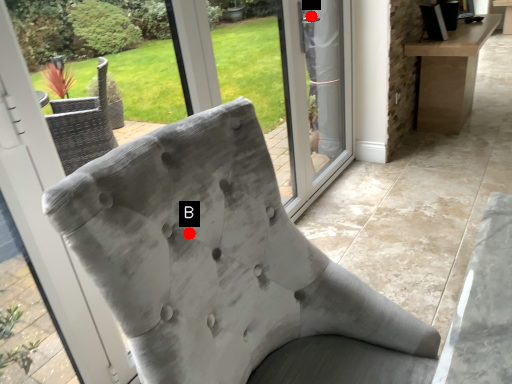
Question: Two points are circled on the image, labeled by A and B beside each circle. Which point appears closest to the camera in this image?

Choices:
 (A) A is closer
 (B) B is closer

Answer: (B)